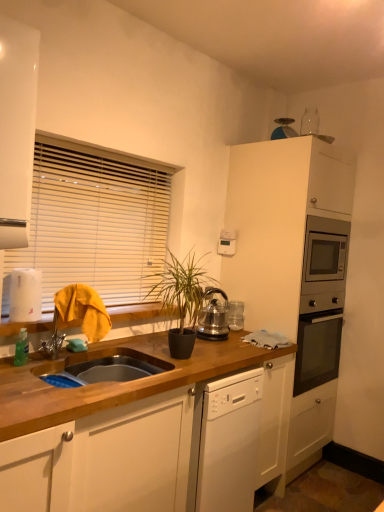
The width and height of the screenshot is (384, 512). Find the location of `free spot in front of polished stainless steel kettle at center`. free spot in front of polished stainless steel kettle at center is located at coordinates (223, 345).